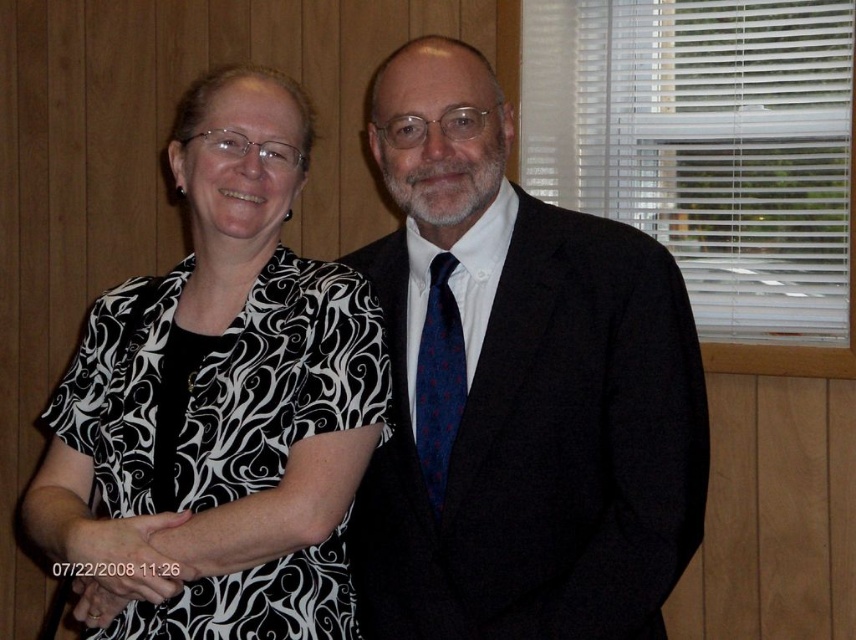
Question: Which of the following is the farthest from the observer?

Choices:
 (A) (563, 408)
 (B) (147, 577)

Answer: (A)

Question: Can you confirm if dark blue textured suit at center is smaller than blue dotted fabric tie at center?

Choices:
 (A) no
 (B) yes

Answer: (A)

Question: Which object appears farthest from the camera in this image?

Choices:
 (A) black and white printed blouse at left
 (B) dark blue textured suit at center
 (C) blue dotted fabric tie at center

Answer: (C)

Question: Among these points, which one is nearest to the camera?

Choices:
 (A) (245, 433)
 (B) (423, 465)

Answer: (A)

Question: Can you confirm if black and white printed blouse at left is positioned to the left of blue dotted fabric tie at center?

Choices:
 (A) yes
 (B) no

Answer: (A)

Question: Can you confirm if dark blue textured suit at center is positioned below blue dotted fabric tie at center?

Choices:
 (A) yes
 (B) no

Answer: (B)